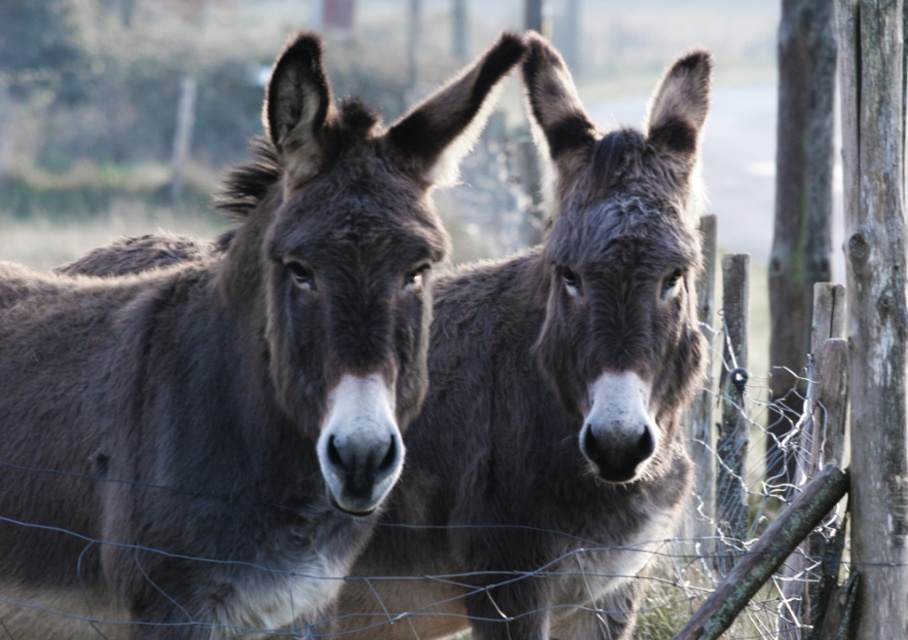
Question: Does dark brown fur mule at center appear over dark gray fur at center?

Choices:
 (A) yes
 (B) no

Answer: (A)

Question: Can you confirm if dark brown fur mule at center is positioned below dark gray fur at center?

Choices:
 (A) yes
 (B) no

Answer: (B)

Question: Which point is farther to the camera?

Choices:
 (A) (402, 472)
 (B) (362, 406)

Answer: (A)

Question: Is dark brown fur mule at center thinner than dark gray fur at center?

Choices:
 (A) no
 (B) yes

Answer: (A)

Question: Which point is closer to the camera?

Choices:
 (A) (506, 321)
 (B) (37, 307)

Answer: (B)